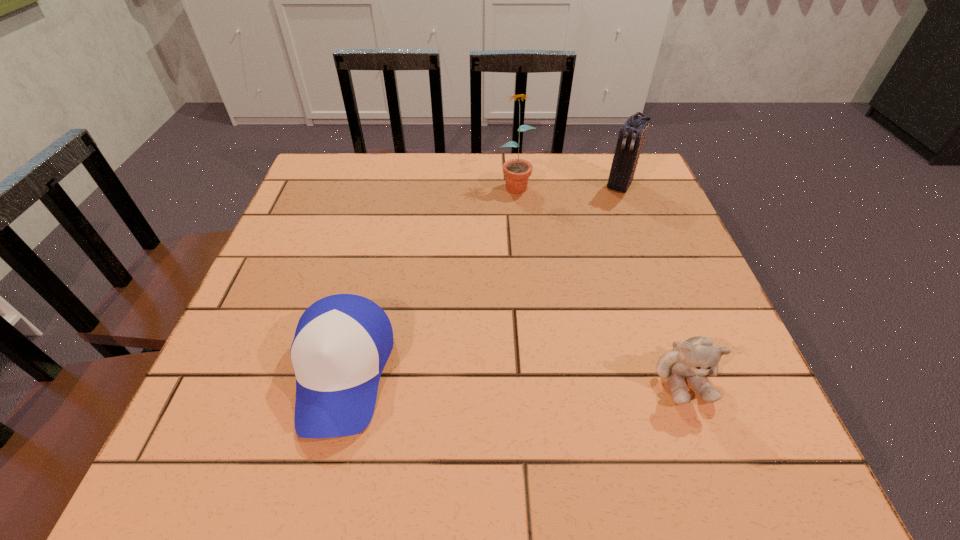
The width and height of the screenshot is (960, 540). Find the location of `object located in the near right corner section of the desktop`. object located in the near right corner section of the desktop is located at coordinates (696, 357).

At what (x,y) coordinates should I click in order to perform the action: click on free space at the far edge of the desktop. Please return your answer as a coordinate pair (x, y). The image size is (960, 540). Looking at the image, I should click on (425, 191).

Where is `free region at the near edge of the desktop`? free region at the near edge of the desktop is located at coordinates (390, 401).

At what (x,y) coordinates should I click in order to perform the action: click on vacant area at the left edge. Please return your answer as a coordinate pair (x, y). The width and height of the screenshot is (960, 540). Looking at the image, I should click on (293, 261).

At what (x,y) coordinates should I click in order to perform the action: click on free space at the right edge of the desktop. Please return your answer as a coordinate pair (x, y). The height and width of the screenshot is (540, 960). Looking at the image, I should click on (632, 209).

In the image, there is a desktop. Where is `vacant space at the far left corner`? Image resolution: width=960 pixels, height=540 pixels. vacant space at the far left corner is located at coordinates (326, 173).

This screenshot has width=960, height=540. In the image, there is a desktop. In order to click on free space at the near left corner in this screenshot , I will do `click(228, 386)`.

This screenshot has width=960, height=540. What are the coordinates of `free space at the far right corner of the desktop` in the screenshot? It's located at (608, 157).

The height and width of the screenshot is (540, 960). I want to click on vacant space at the near right corner of the desktop, so click(744, 386).

Identify the location of free area in between the teddy bear and the baseball cap. Image resolution: width=960 pixels, height=540 pixels. (513, 375).